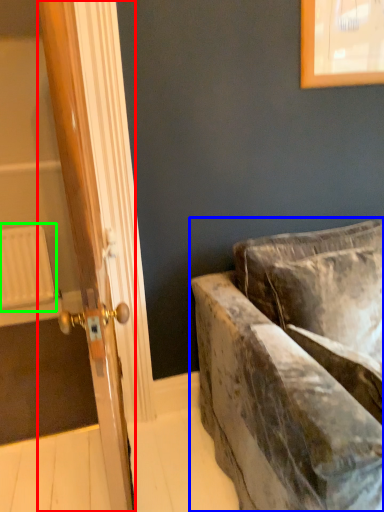
Question: Estimate the real-world distances between objects in this image. Which object is farther from door (highlighted by a red box), studio couch (highlighted by a blue box) or radiator (highlighted by a green box)?

Choices:
 (A) studio couch
 (B) radiator

Answer: (B)